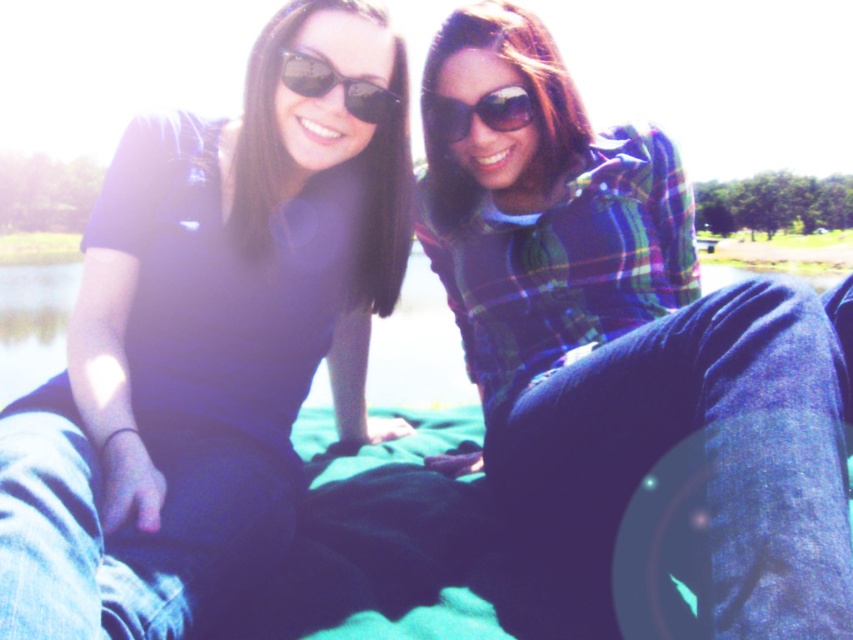
Does black reflective sunglasses at upper center have a lesser width compared to green grass at lower left?

Indeed, black reflective sunglasses at upper center has a lesser width compared to green grass at lower left.

Does black reflective sunglasses at upper center have a greater width compared to green grass at lower left?

No, black reflective sunglasses at upper center is not wider than green grass at lower left.

Is point (372, 106) closer to viewer compared to point (9, 234)?

Yes.

You are a GUI agent. You are given a task and a screenshot of the screen. Output one action in this format:
    pyautogui.click(x=<x>, y=<y>)
    Task: Click on the black reflective sunglasses at upper center
    This screenshot has height=640, width=853.
    Given the screenshot: What is the action you would take?
    pyautogui.click(x=335, y=84)

Which is below, matte black shirt at center or green grass at lower left?

Positioned lower is matte black shirt at center.

Does matte black shirt at center appear on the right side of green grass at lower left?

Correct, you'll find matte black shirt at center to the right of green grass at lower left.

This screenshot has width=853, height=640. I want to click on matte black shirt at center, so click(x=207, y=344).

Does matte black shirt at center lie behind black reflective sunglasses at upper center?

No.

Measure the distance between point (x=86, y=321) and camera.

They are 4.45 feet apart.

The height and width of the screenshot is (640, 853). In order to click on matte black shirt at center in this screenshot , I will do `click(207, 344)`.